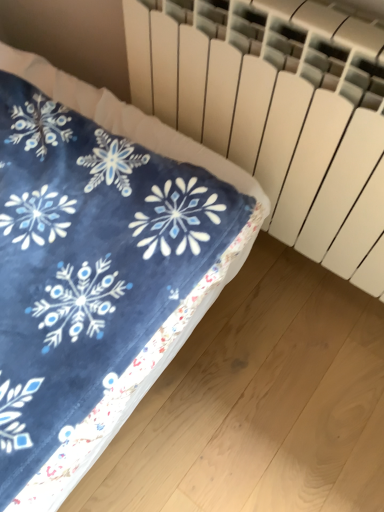
Describe the element at coordinates (272, 138) in the screenshot. I see `white matte radiator at upper right` at that location.

At what (x,y) coordinates should I click in order to perform the action: click on white matte radiator at upper right. Please return your answer as a coordinate pair (x, y). The width and height of the screenshot is (384, 512). Looking at the image, I should click on (272, 138).

Where is `white matte radiator at upper right`? This screenshot has width=384, height=512. white matte radiator at upper right is located at coordinates (272, 138).